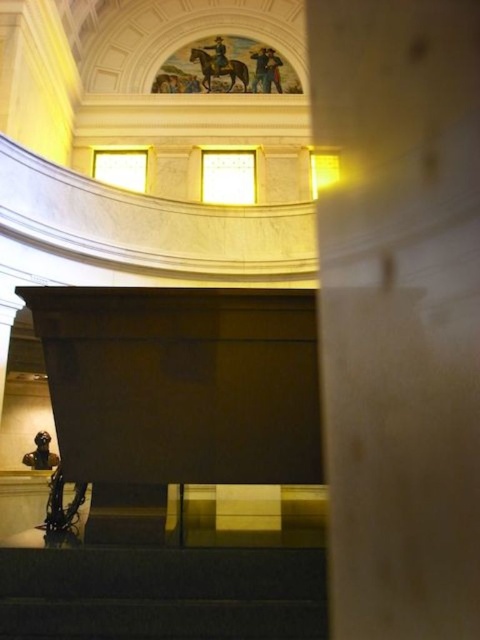
Question: Which is nearer to the blue fabric uniform at upper center?

Choices:
 (A) white marble pillar at center
 (B) dark blue uniform at upper center

Answer: (B)

Question: Which of the following is the closest to the observer?

Choices:
 (A) coord(371,68)
 (B) coord(265,54)
 (C) coord(215,45)
 (D) coord(264,48)

Answer: (A)

Question: Is blue fabric uniform at upper center to the right of light brown leather horse at upper center from the viewer's perspective?

Choices:
 (A) yes
 (B) no

Answer: (A)

Question: Does white marble pillar at center appear over blue fabric uniform at upper center?

Choices:
 (A) no
 (B) yes

Answer: (A)

Question: Which of the following is the farthest from the observer?

Choices:
 (A) (469, 67)
 (B) (219, 42)
 (C) (280, 60)

Answer: (B)

Question: Is white marble pillar at center below light brown leather horse at upper center?

Choices:
 (A) no
 (B) yes

Answer: (B)